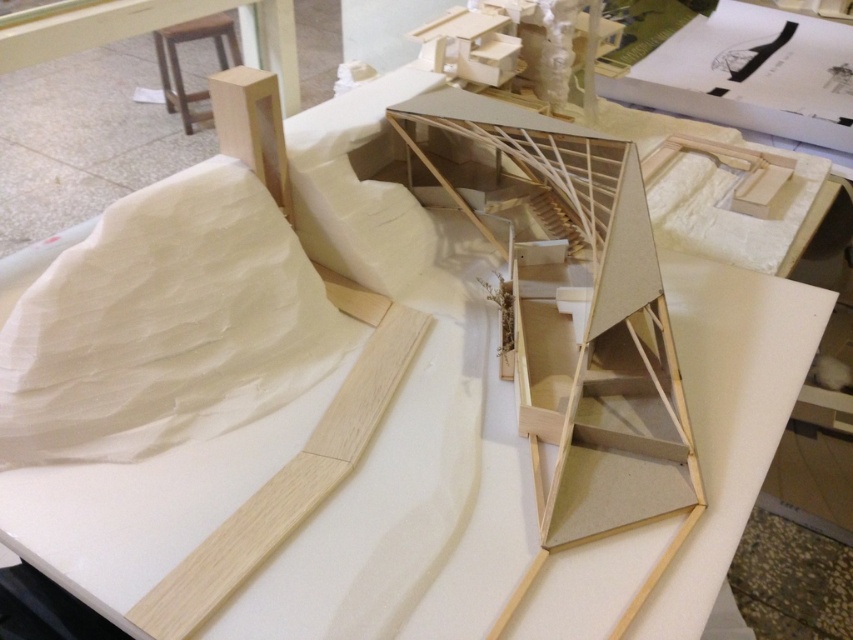
Question: Which point is closer to the camera taking this photo?

Choices:
 (A) (207, 216)
 (B) (280, 490)

Answer: (B)

Question: Which point is farther from the camera taking this photo?

Choices:
 (A) (138, 292)
 (B) (399, 337)

Answer: (B)

Question: Is white paper at upper left wider than natural wood plank at lower left?

Choices:
 (A) yes
 (B) no

Answer: (A)

Question: Is white paper at upper left above natural wood plank at lower left?

Choices:
 (A) yes
 (B) no

Answer: (A)

Question: Does white paper at upper left have a smaller size compared to natural wood plank at lower left?

Choices:
 (A) yes
 (B) no

Answer: (A)